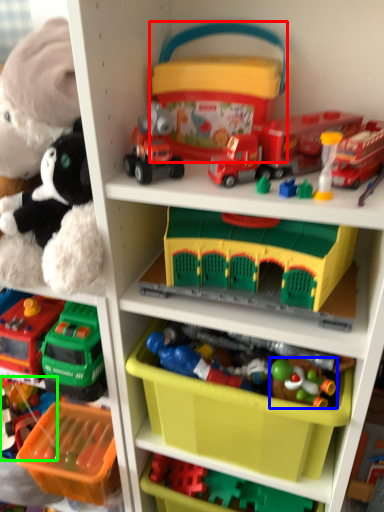
Question: Which is farther away from storage box (highlighted by a red box)? toy (highlighted by a blue box) or toy (highlighted by a green box)?

Choices:
 (A) toy
 (B) toy

Answer: (B)